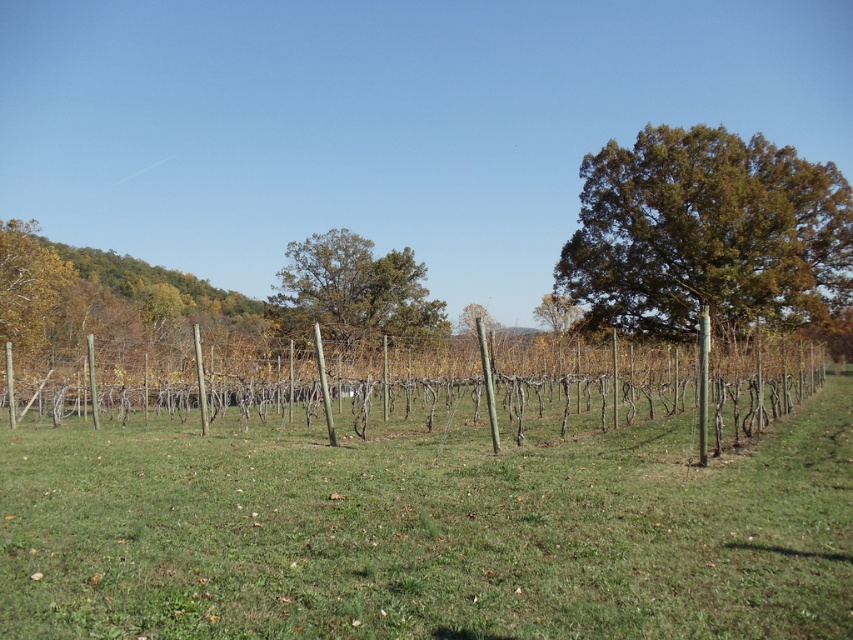
You are standing in the vineyard and want to walk from the green grass at center to the brown rough tree at center. Which direction should you face to walk directly towards it?

You should face to the right because the green grass at center is to the left of the brown rough tree at center, so walking towards the right will lead you directly to it.

You are a gardener planning to place a decorative stone path between the green grass at center and the brown rough tree at center. Based on their widths, which area should the path be placed closer to?

The path should be placed closer to the brown rough tree at center because the green grass at center might be wider, leaving more space on the tree side for the path.